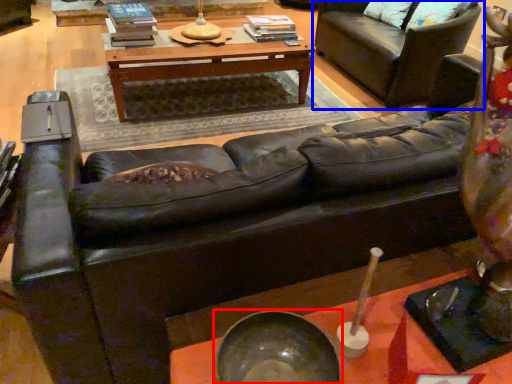
Question: Which point is closer to the camera, bowl (highlighted by a red box) or studio couch (highlighted by a blue box)?

Choices:
 (A) bowl
 (B) studio couch

Answer: (A)